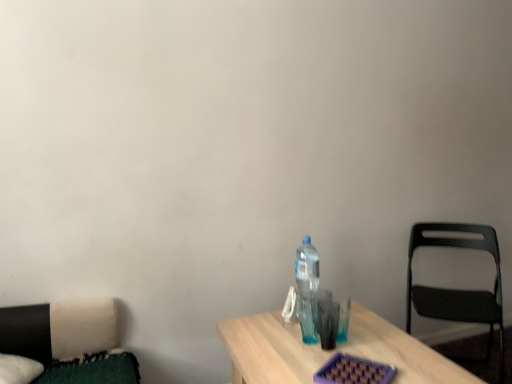
Question: Is transparent plastic bottle at center-right positioned in front of black plastic chair at right?

Choices:
 (A) no
 (B) yes

Answer: (B)

Question: Is transparent plastic bottle at center-right at the right side of black plastic chair at right?

Choices:
 (A) yes
 (B) no

Answer: (B)

Question: From the image's perspective, does transparent plastic bottle at center-right appear higher than black plastic chair at right?

Choices:
 (A) yes
 (B) no

Answer: (A)

Question: Could you tell me if transparent plastic bottle at center-right is turned towards black plastic chair at right?

Choices:
 (A) yes
 (B) no

Answer: (A)

Question: From the image's perspective, does transparent plastic bottle at center-right appear lower than black plastic chair at right?

Choices:
 (A) no
 (B) yes

Answer: (A)

Question: Can you confirm if transparent plastic bottle at center-right is positioned to the left of black plastic chair at right?

Choices:
 (A) yes
 (B) no

Answer: (A)

Question: From a real-world perspective, is black plastic chair at right on top of transparent plastic bottle at center-right?

Choices:
 (A) yes
 (B) no

Answer: (B)

Question: From the image's perspective, does black plastic chair at right appear lower than transparent plastic bottle at center-right?

Choices:
 (A) no
 (B) yes

Answer: (B)

Question: Is black plastic chair at right at the right side of transparent plastic bottle at center-right?

Choices:
 (A) yes
 (B) no

Answer: (A)

Question: Does black plastic chair at right lie in front of transparent plastic bottle at center-right?

Choices:
 (A) no
 (B) yes

Answer: (A)

Question: Does black plastic chair at right have a greater width compared to transparent plastic bottle at center-right?

Choices:
 (A) no
 (B) yes

Answer: (B)

Question: Can you confirm if black plastic chair at right is bigger than transparent plastic bottle at center-right?

Choices:
 (A) yes
 (B) no

Answer: (A)

Question: Is black plastic chair at right to the left or to the right of transparent plastic bottle at center-right in the image?

Choices:
 (A) left
 (B) right

Answer: (B)